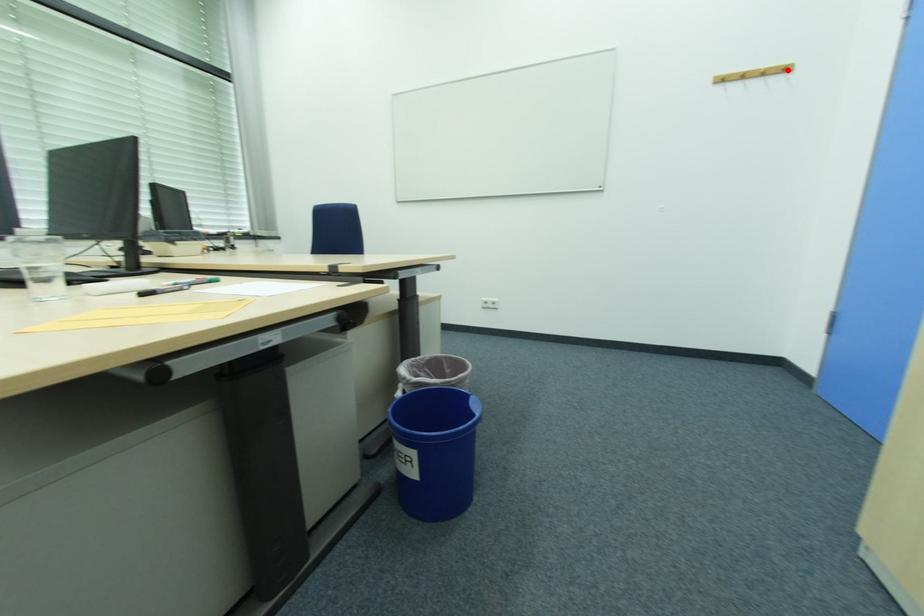
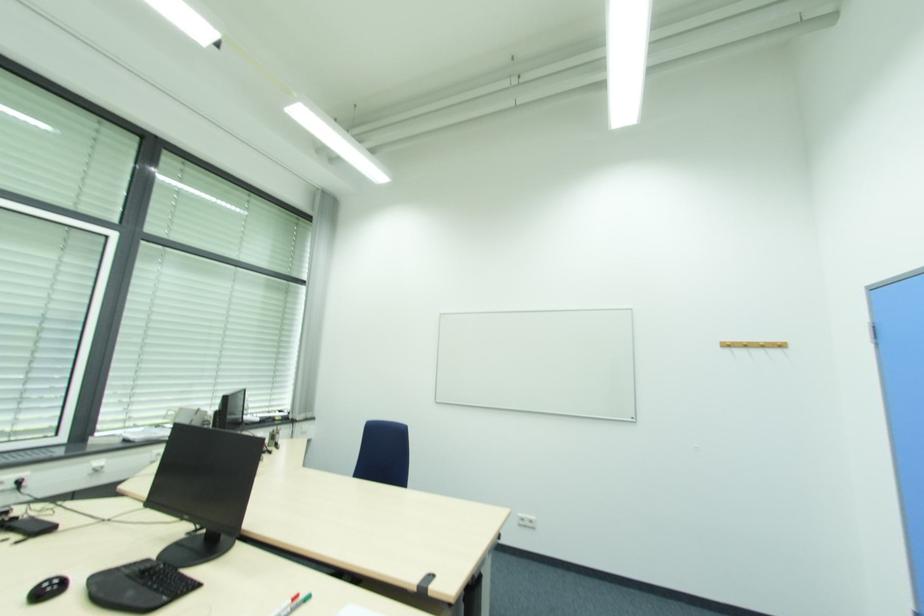
The point at the highlighted location is marked in the first image. Where is the corresponding point in the second image?

(784, 346)